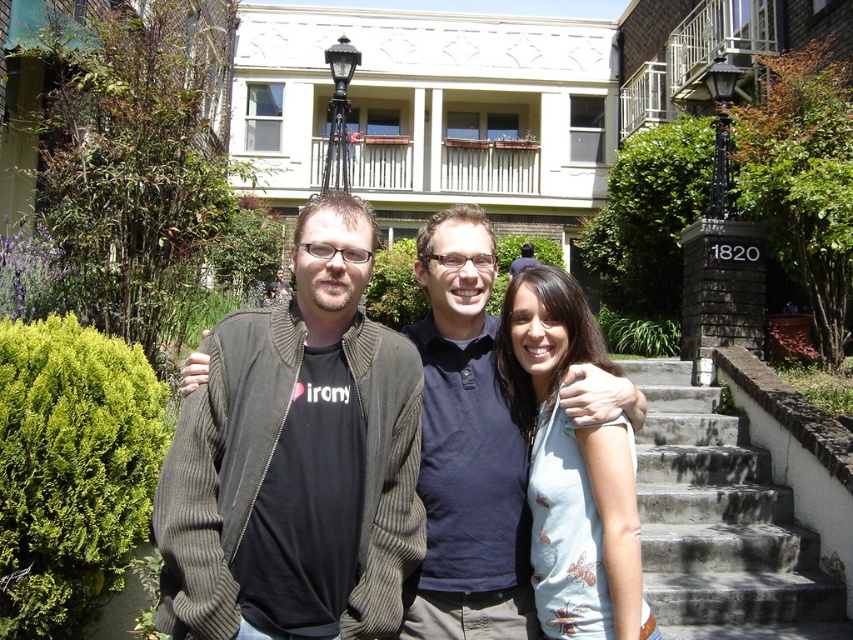
You are standing at the point with coordinates point (335, 164) and want to walk to the point with coordinates point (631, 419). Which direction should you move in to reach your destination?

You should move forward because point (631, 419) is in front of point (335, 164).